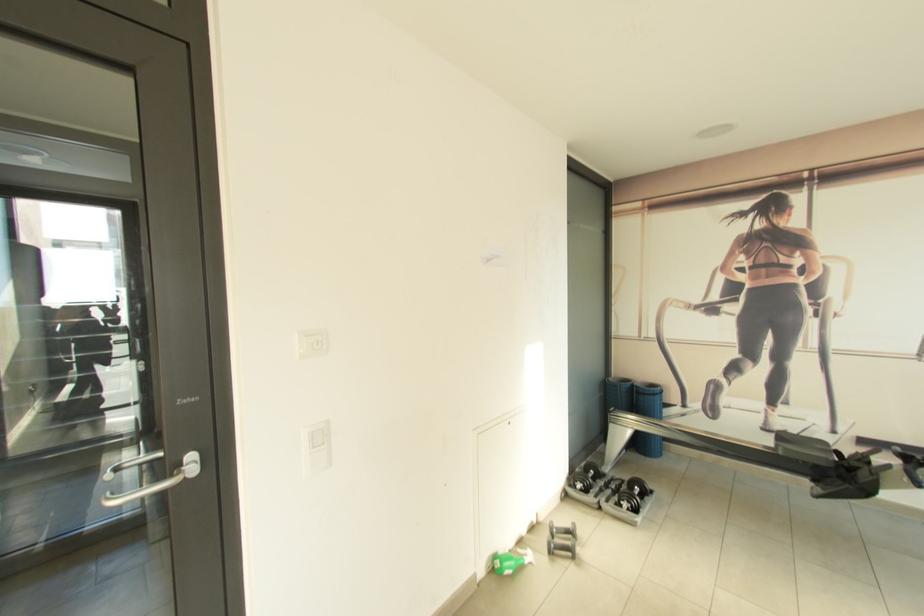
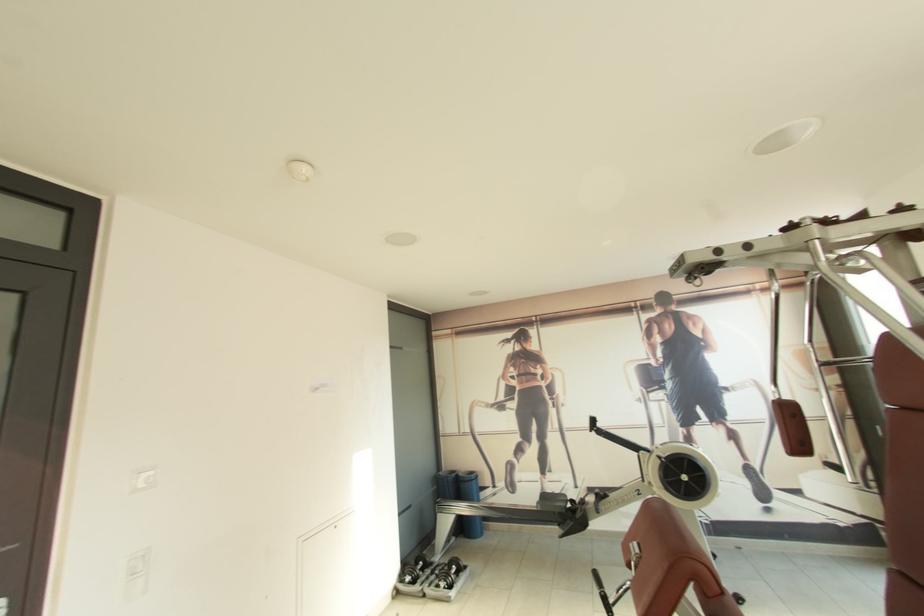
In the second image, find the point that corresponds to the point at 614,493 in the first image.

(436, 578)